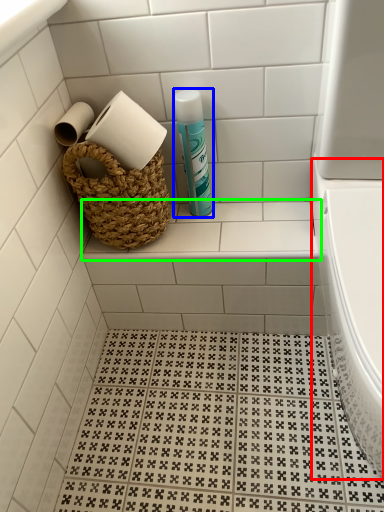
Question: Based on their relative distances, which object is farther from bath (highlighted by a red box)? Choose from cleaning product (highlighted by a blue box) and ledge (highlighted by a green box).

Choices:
 (A) cleaning product
 (B) ledge

Answer: (A)